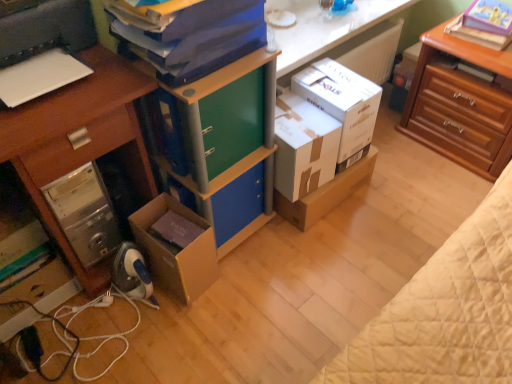
Where is `vacant area located to the right-hand side of white cardboard box at center`? The height and width of the screenshot is (384, 512). vacant area located to the right-hand side of white cardboard box at center is located at coordinates (398, 194).